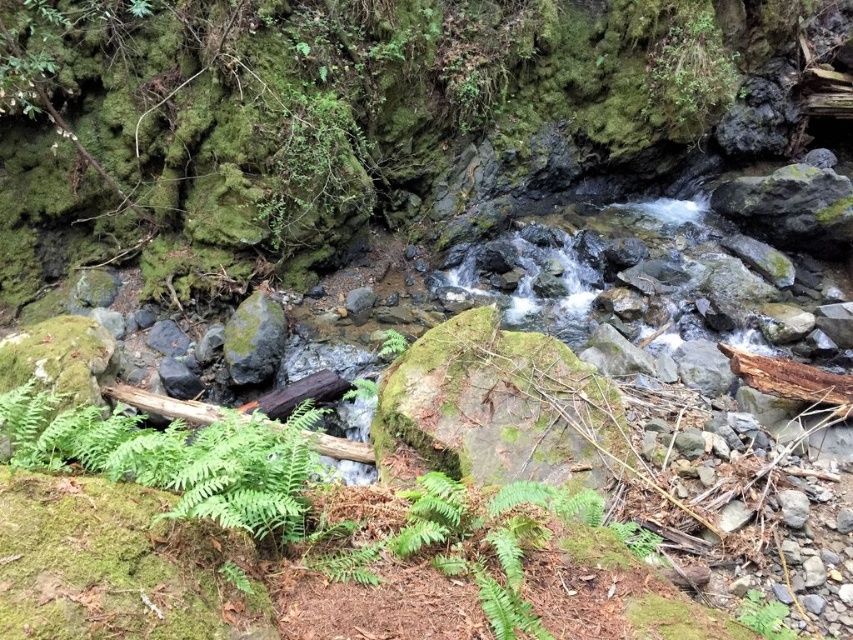
Is point (35, 426) positioned before point (753, 612)?

Yes, it is.

Is point (183, 461) farther from camera compared to point (764, 600)?

That is False.

Is point (57, 433) more distant than point (764, 632)?

That is False.

Find the location of `green matte fern at lower left`. green matte fern at lower left is located at coordinates (175, 458).

Between green mossy rock at center and green matte fern at lower right, which one is positioned lower?

green matte fern at lower right is lower down.

Is green mossy rock at center to the left of green matte fern at lower right from the viewer's perspective?

Yes, green mossy rock at center is to the left of green matte fern at lower right.

This screenshot has height=640, width=853. I want to click on green mossy rock at center, so click(254, 339).

Does green matte fern at lower left come in front of green mossy rock at center?

That is True.

Which is more to the right, green matte fern at lower left or green mossy rock at center?

From the viewer's perspective, green matte fern at lower left appears more on the right side.

Is point (192, 500) closer to viewer compared to point (236, 339)?

Yes.

Locate an element on the screen. green matte fern at lower left is located at coordinates (175, 458).